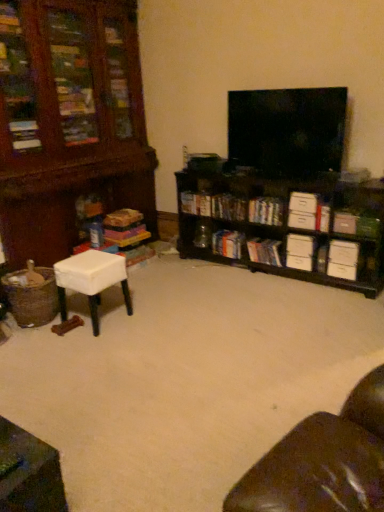
Question: Choose the correct answer: Is white cardboard box at center-right, which ranks as the fifth book in left-to-right order, inside black wood shelf at center right or outside it?

Choices:
 (A) inside
 (B) outside

Answer: (A)

Question: Is white cardboard box at center-right, which ranks as the third book in right-to-left order, in front of or behind black wood shelf at center right in the image?

Choices:
 (A) behind
 (B) front

Answer: (A)

Question: Which object is positioned farthest from the white cardboard drawer at right, positioned as the 1th drawer in bottom-to-top order?

Choices:
 (A) matte cardboard book at left, the 7th book viewed from the right
 (B) hardcover books at center, marked as the sixth book in a right-to-left arrangement
 (C) white cardboard box at right, marked as the second book in a right-to-left arrangement
 (D) white cardboard box at right, placed as the seventh book when sorted from left to right
 (E) white cardboard box at center-right, which ranks as the third book in right-to-left order

Answer: (A)

Question: Which is nearer to the white cardboard drawer at lower right, which appears as the 2th drawer when ordered from the bottom?

Choices:
 (A) white cardboard drawer at right, positioned as the 1th drawer in bottom-to-top order
 (B) white fabric stool at lower left, the 1th table in the back-to-front sequence
 (C) white cardboard box at right, the 6th book positioned from the left
 (D) white cardboard drawer at right, which ranks as the third drawer in bottom-to-top order
 (E) hardcover book at center, placed as the fifth book when sorted from right to left

Answer: (A)